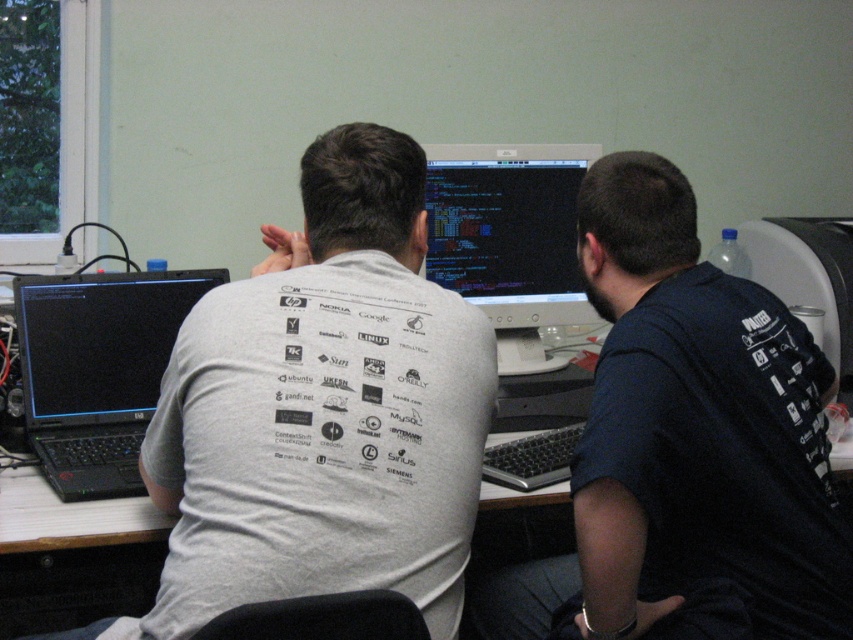
Question: Which is farther from the matte black monitor at center?

Choices:
 (A) gray cotton t-shirt at center
 (B) dark blue t-shirt at center
 (C) black matte laptop at left

Answer: (A)

Question: Is dark blue t-shirt at center bigger than matte black monitor at center?

Choices:
 (A) no
 (B) yes

Answer: (B)

Question: Among these points, which one is nearest to the camera?

Choices:
 (A) pos(126,381)
 (B) pos(262,499)

Answer: (B)

Question: Among these points, which one is farthest from the camera?

Choices:
 (A) (759, 492)
 (B) (119, 461)

Answer: (B)

Question: Can you confirm if gray cotton t-shirt at center is positioned to the right of black matte laptop at left?

Choices:
 (A) no
 (B) yes

Answer: (B)

Question: Does dark blue t-shirt at center have a smaller size compared to black matte laptop at left?

Choices:
 (A) no
 (B) yes

Answer: (A)